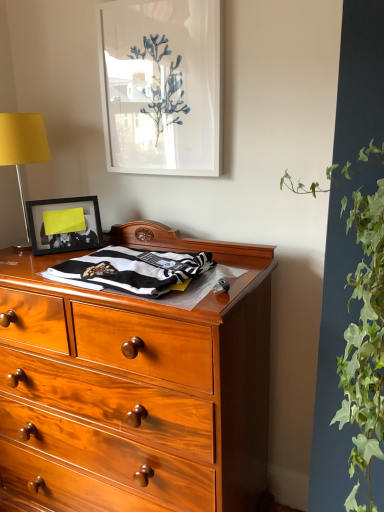
Question: Considering the relative sizes of matte black picture frame at upper left, the second picture frame in the right-to-left sequence, and green leafy plant at right in the image provided, is matte black picture frame at upper left, the second picture frame in the right-to-left sequence, smaller than green leafy plant at right?

Choices:
 (A) no
 (B) yes

Answer: (B)

Question: Considering the relative positions of matte black picture frame at upper left, which appears as the 1th picture frame when ordered from the bottom, and green leafy plant at right in the image provided, is matte black picture frame at upper left, which appears as the 1th picture frame when ordered from the bottom, in front of green leafy plant at right?

Choices:
 (A) yes
 (B) no

Answer: (B)

Question: From a real-world perspective, is matte black picture frame at upper left, placed as the 2th picture frame when sorted from top to bottom, located beneath green leafy plant at right?

Choices:
 (A) yes
 (B) no

Answer: (B)

Question: Is matte black picture frame at upper left, which appears as the 1th picture frame when ordered from the bottom, shorter than green leafy plant at right?

Choices:
 (A) no
 (B) yes

Answer: (B)

Question: Considering the relative sizes of matte black picture frame at upper left, the second picture frame in the right-to-left sequence, and green leafy plant at right in the image provided, is matte black picture frame at upper left, the second picture frame in the right-to-left sequence, taller than green leafy plant at right?

Choices:
 (A) no
 (B) yes

Answer: (A)

Question: Visually, is white glossy picture frame at upper center, arranged as the 1th picture frame when viewed from the right, positioned to the left or to the right of black and white striped fabric at center?

Choices:
 (A) right
 (B) left

Answer: (A)

Question: Considering the positions of white glossy picture frame at upper center, arranged as the 1th picture frame when viewed from the right, and black and white striped fabric at center in the image, is white glossy picture frame at upper center, arranged as the 1th picture frame when viewed from the right, bigger or smaller than black and white striped fabric at center?

Choices:
 (A) big
 (B) small

Answer: (B)

Question: Looking at their shapes, would you say white glossy picture frame at upper center, positioned as the second picture frame in bottom-to-top order, is wider or thinner than black and white striped fabric at center?

Choices:
 (A) thin
 (B) wide

Answer: (A)

Question: Is point coord(178,48) positioned closer to the camera than point coord(41,273)?

Choices:
 (A) farther
 (B) closer

Answer: (A)

Question: Considering the positions of black and white striped fabric at center and matte black picture frame at upper left, the first picture frame from the left, in the image, is black and white striped fabric at center bigger or smaller than matte black picture frame at upper left, the first picture frame from the left,?

Choices:
 (A) big
 (B) small

Answer: (A)

Question: Would you say black and white striped fabric at center is to the left or to the right of matte black picture frame at upper left, the second picture frame in the right-to-left sequence, in the picture?

Choices:
 (A) left
 (B) right

Answer: (B)

Question: From the image's perspective, is black and white striped fabric at center positioned above or below matte black picture frame at upper left, which appears as the 1th picture frame when ordered from the bottom?

Choices:
 (A) above
 (B) below

Answer: (B)

Question: Is black and white striped fabric at center wider or thinner than matte black picture frame at upper left, which appears as the 1th picture frame when ordered from the bottom?

Choices:
 (A) wide
 (B) thin

Answer: (A)

Question: From the image's perspective, is green leafy plant at right positioned above or below black and white striped fabric at center?

Choices:
 (A) above
 (B) below

Answer: (B)

Question: From a real-world perspective, is green leafy plant at right positioned above or below black and white striped fabric at center?

Choices:
 (A) above
 (B) below

Answer: (B)